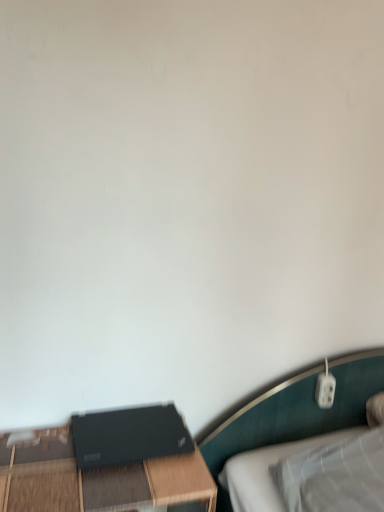
Find the location of a particular element. This screenshot has width=384, height=512. free spot above black matte laptop at lower left (from a real-world perspective) is located at coordinates 125,423.